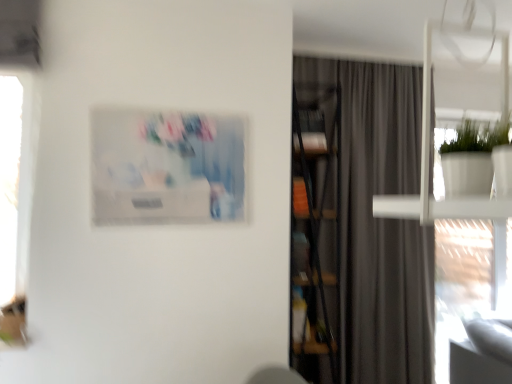
Question: Is wooden bookcase at center in front of or behind gray matte curtain at center in the image?

Choices:
 (A) front
 (B) behind

Answer: (A)

Question: From the image's perspective, is wooden bookcase at center located above or below gray matte curtain at center?

Choices:
 (A) below
 (B) above

Answer: (A)

Question: Which object is the farthest from the gray matte curtain at center?

Choices:
 (A) wooden bookcase at center
 (B) matte plastic picture frame at upper center

Answer: (B)

Question: Estimate the real-world distances between objects in this image. Which object is closer to the matte plastic picture frame at upper center?

Choices:
 (A) gray matte curtain at center
 (B) wooden bookcase at center

Answer: (B)